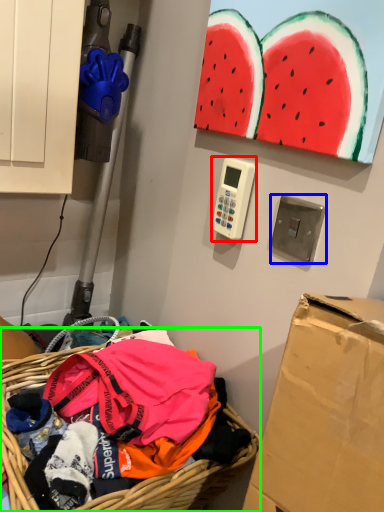
Question: Based on their relative distances, which object is farther from scale (highlighted by a red box)? Choose from light switch (highlighted by a blue box) and basket (highlighted by a green box).

Choices:
 (A) light switch
 (B) basket

Answer: (A)